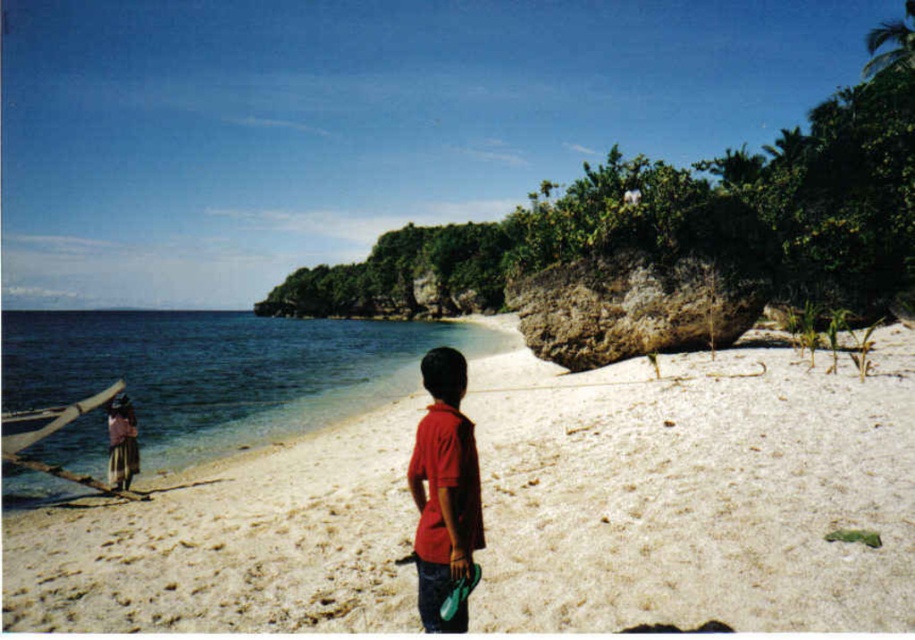
Is white sandy beach at center taller than red matte shirt at center?

Yes, white sandy beach at center is taller than red matte shirt at center.

From the picture: Is white sandy beach at center shorter than red matte shirt at center?

In fact, white sandy beach at center may be taller than red matte shirt at center.

Which is in front, point (874, 589) or point (461, 420)?

Point (461, 420)

At what (x,y) coordinates should I click in order to perform the action: click on white sandy beach at center. Please return your answer as a coordinate pair (x, y). The height and width of the screenshot is (640, 915). Looking at the image, I should click on (696, 492).

Is point (584, 474) positioned in front of point (109, 403)?

Yes.

Does white sandy beach at center appear over brown woven fabric at left?

Yes.

The width and height of the screenshot is (915, 640). In order to click on white sandy beach at center in this screenshot , I will do `click(696, 492)`.

This screenshot has width=915, height=640. In order to click on white sandy beach at center in this screenshot , I will do `click(696, 492)`.

Who is shorter, clear blue water at lower left or red matte shirt at center?

Standing shorter between the two is red matte shirt at center.

Which of these two, clear blue water at lower left or red matte shirt at center, stands taller?

clear blue water at lower left is taller.

Does point (185, 368) lie in front of point (466, 474)?

No, it is behind (466, 474).

Locate an element on the screen. The image size is (915, 640). clear blue water at lower left is located at coordinates (221, 371).